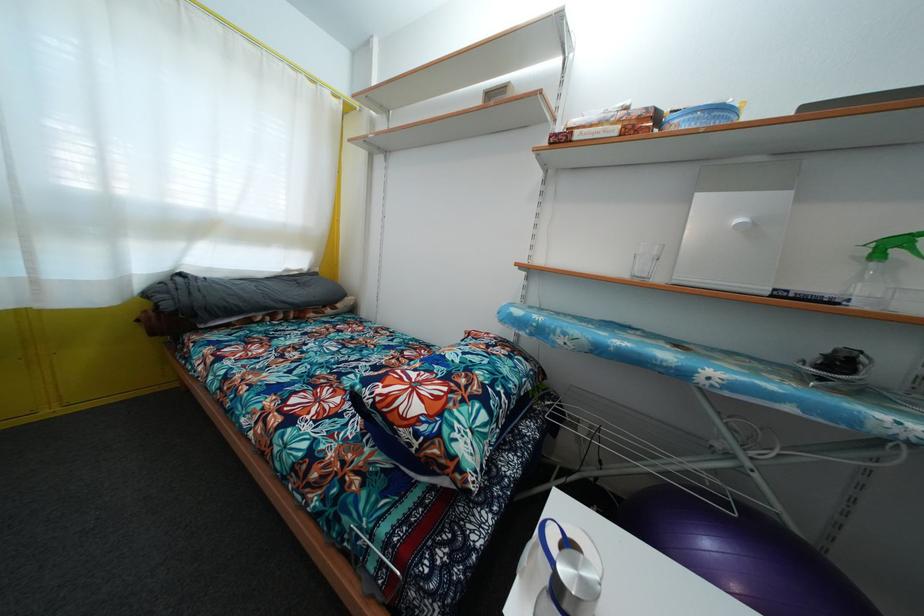
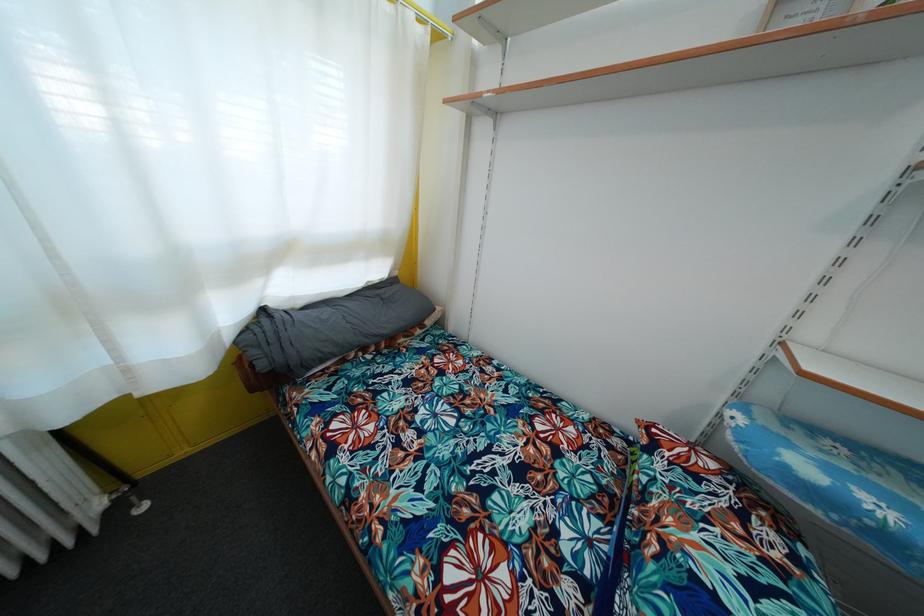
Question: Based on the continuous images, in which direction is the camera rotating? Reply with the corresponding letter.

Choices:
 (A) Left
 (B) Right
 (C) Up
 (D) Down

Answer: (D)